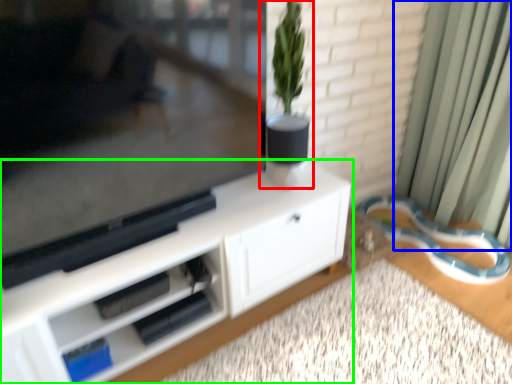
Question: Considering the real-world distances, which object is closest to houseplant (highlighted by a red box)? curtain (highlighted by a blue box) or cabinetry (highlighted by a green box).

Choices:
 (A) curtain
 (B) cabinetry

Answer: (B)